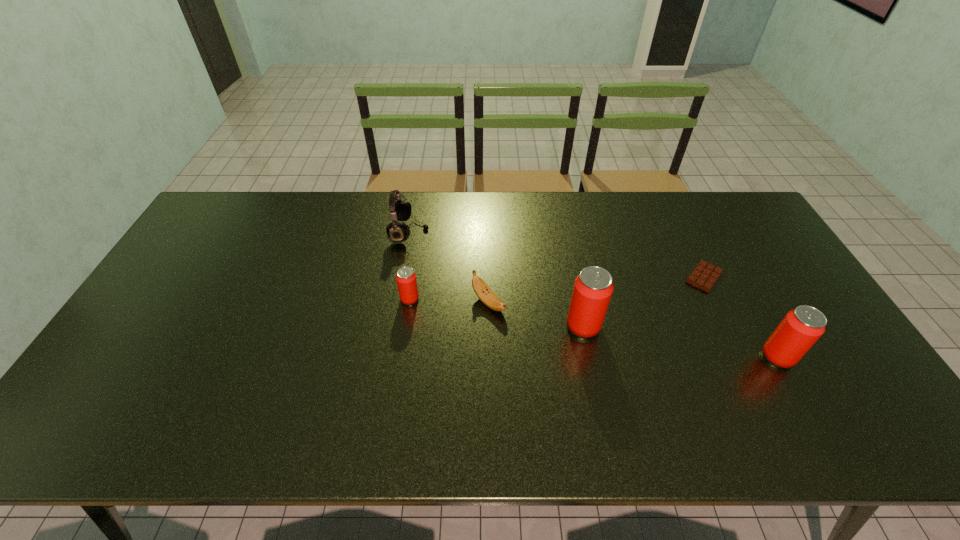
Where is `vacant area in the image that satisfies the following two spatial constraints: 1. with the microphone on the side of the headset; 2. on the right side of the shortest object`? vacant area in the image that satisfies the following two spatial constraints: 1. with the microphone on the side of the headset; 2. on the right side of the shortest object is located at coordinates (401, 277).

Where is `free region that satisfies the following two spatial constraints: 1. with the microphone on the side of the headset; 2. on the right side of the candy bar`? The height and width of the screenshot is (540, 960). free region that satisfies the following two spatial constraints: 1. with the microphone on the side of the headset; 2. on the right side of the candy bar is located at coordinates (401, 277).

Locate an element on the screen. vacant point that satisfies the following two spatial constraints: 1. with the microphone on the side of the candy bar; 2. on the right side of the headset is located at coordinates (401, 277).

At what (x,y) coordinates should I click in order to perform the action: click on free space that satisfies the following two spatial constraints: 1. with the microphone on the side of the headset; 2. on the left side of the shortest object. Please return your answer as a coordinate pair (x, y). The width and height of the screenshot is (960, 540). Looking at the image, I should click on tap(401, 277).

This screenshot has height=540, width=960. I want to click on blank space that satisfies the following two spatial constraints: 1. on the back side of the banana; 2. with the microphone on the side of the farthest object, so click(x=488, y=232).